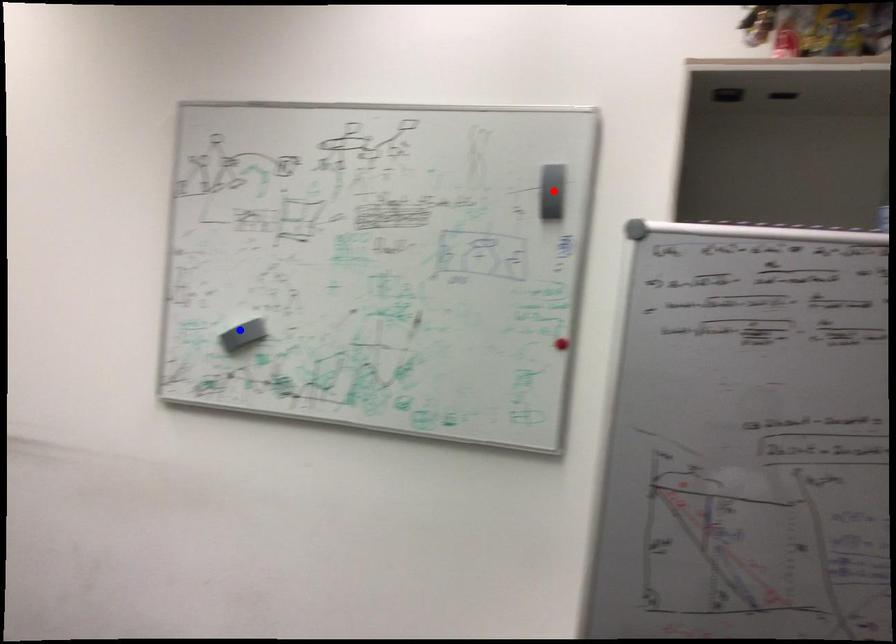
Question: Which of the two points in the image is closer to the camera?

Choices:
 (A) Blue point is closer.
 (B) Red point is closer.

Answer: (B)